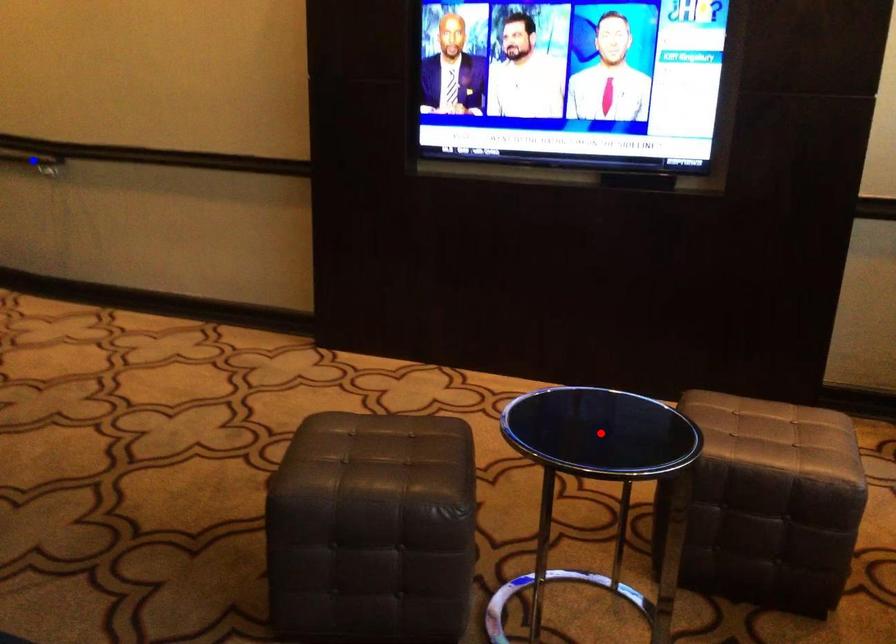
Question: Which of the two points in the image is closer to the camera?

Choices:
 (A) Blue point is closer.
 (B) Red point is closer.

Answer: (B)